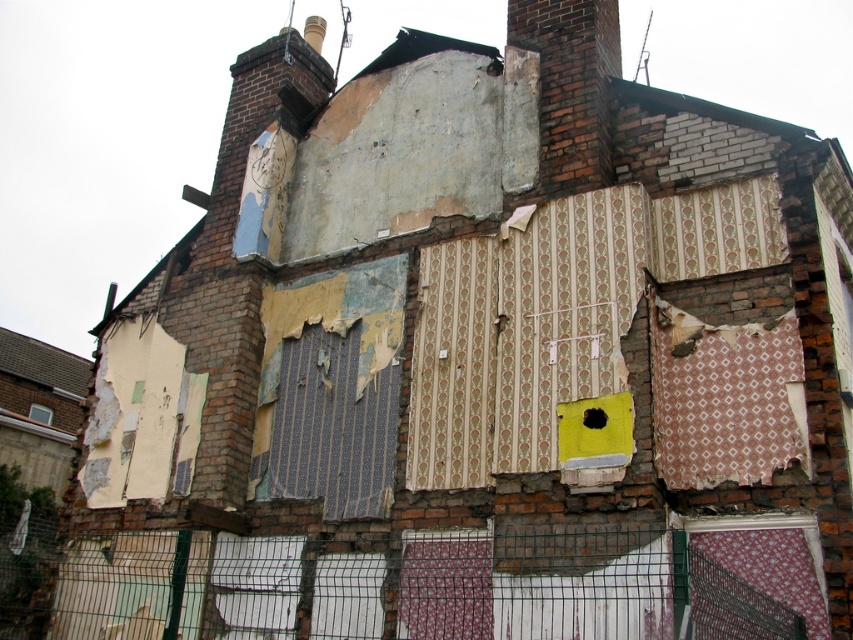
Question: Considering the relative positions of wire mesh fence at lower center and black matte hole at center in the image provided, where is wire mesh fence at lower center located with respect to black matte hole at center?

Choices:
 (A) right
 (B) left

Answer: (B)

Question: In this image, where is wire mesh fence at lower center located relative to black matte hole at center?

Choices:
 (A) right
 (B) left

Answer: (B)

Question: Which point appears closest to the camera in this image?

Choices:
 (A) (618, 598)
 (B) (589, 413)

Answer: (A)

Question: Does wire mesh fence at lower center have a lesser width compared to black matte hole at center?

Choices:
 (A) no
 (B) yes

Answer: (A)

Question: Which point is farther from the camera taking this photo?

Choices:
 (A) (663, 556)
 (B) (602, 410)

Answer: (B)

Question: Which object is farther from the camera taking this photo?

Choices:
 (A) black matte hole at center
 (B) wire mesh fence at lower center

Answer: (A)